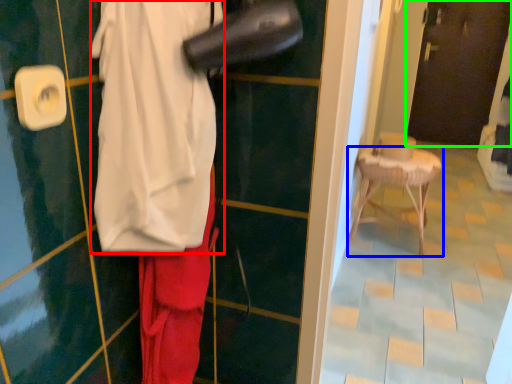
Question: Estimate the real-world distances between objects in this image. Which object is farther from wide (highlighted by a red box), furniture (highlighted by a blue box) or door (highlighted by a green box)?

Choices:
 (A) furniture
 (B) door

Answer: (B)